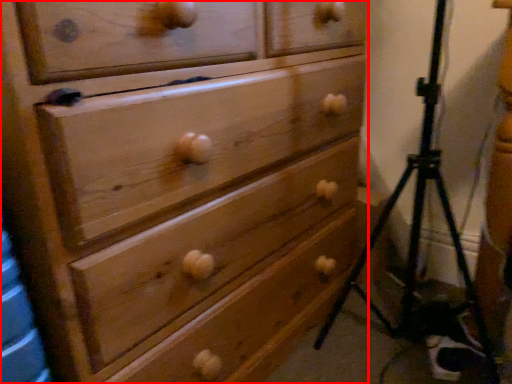
Question: From the image's perspective, what is the correct spatial relationship of chest of drawers (annotated by the red box) in relation to tripod?

Choices:
 (A) below
 (B) above

Answer: (B)